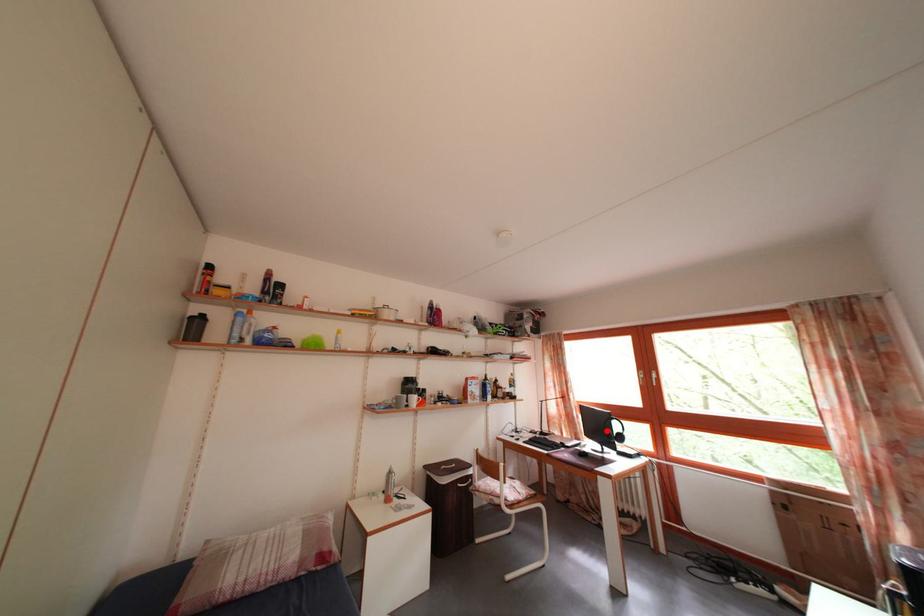
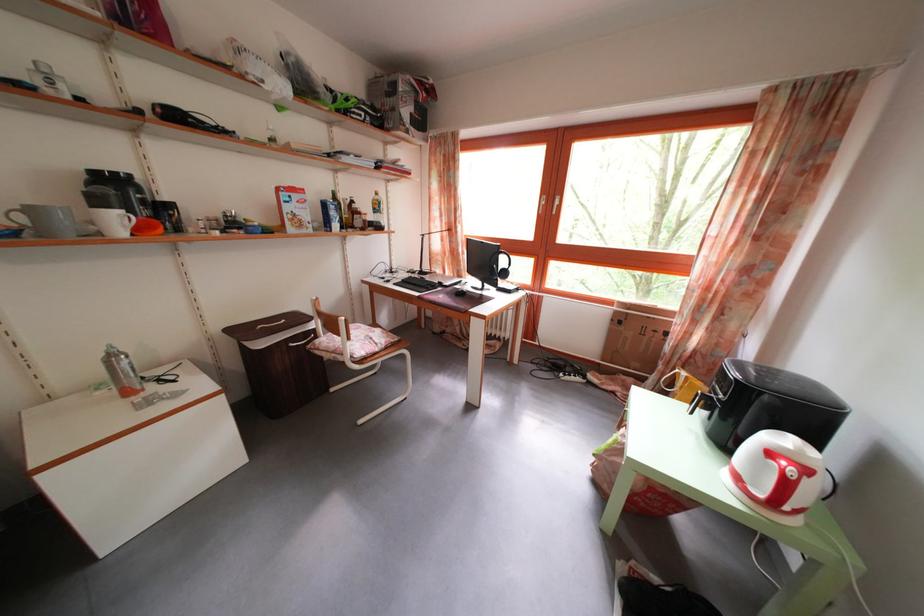
Question: I am providing you with two images of the same scene from different viewpoints. A red point is shown in image1. For the corresponding object point in image2, is it positioned nearer or farther from the camera?

Choices:
 (A) Nearer
 (B) Farther

Answer: (A)